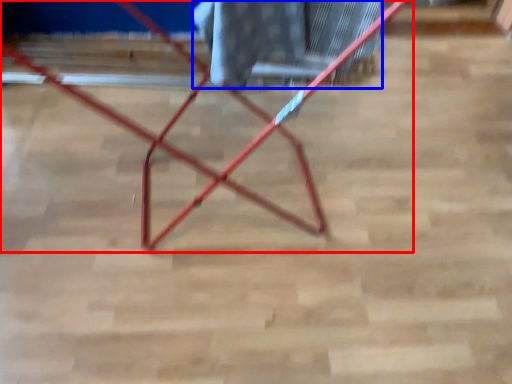
Question: Among these objects, which one is nearest to the camera, furniture (highlighted by a red box) or laundry (highlighted by a blue box)?

Choices:
 (A) furniture
 (B) laundry

Answer: (A)